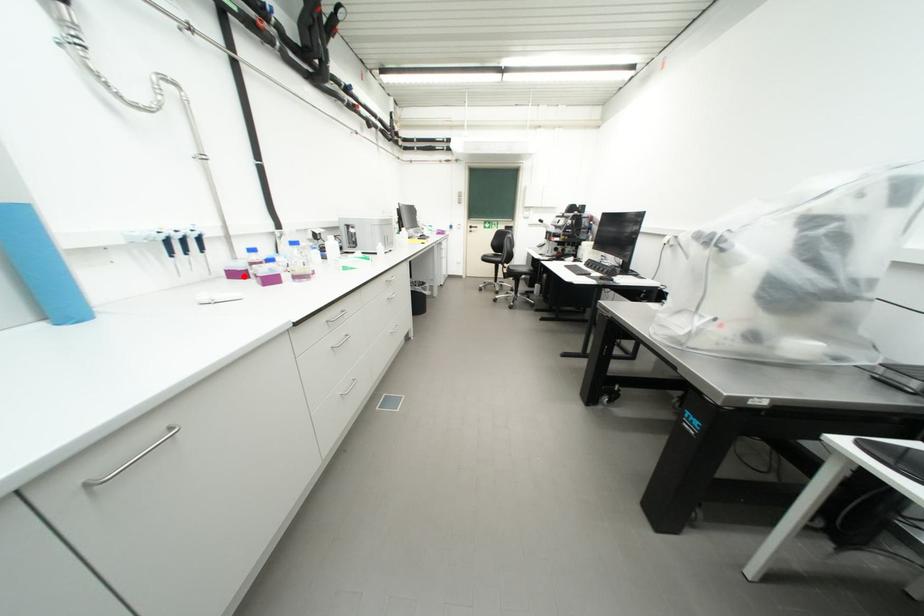
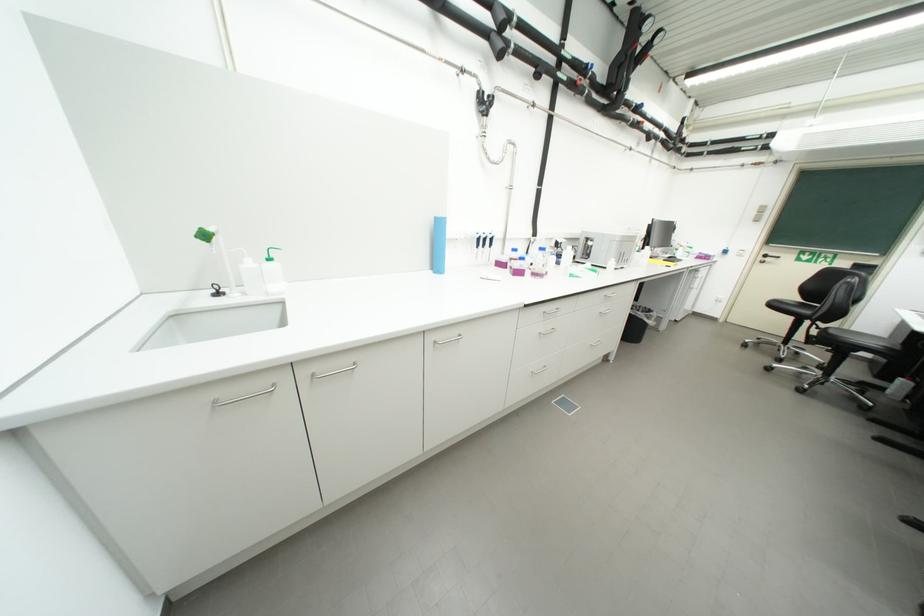
Where in the second image is the point corresponding to the highlighted location from the first image?

(507, 265)